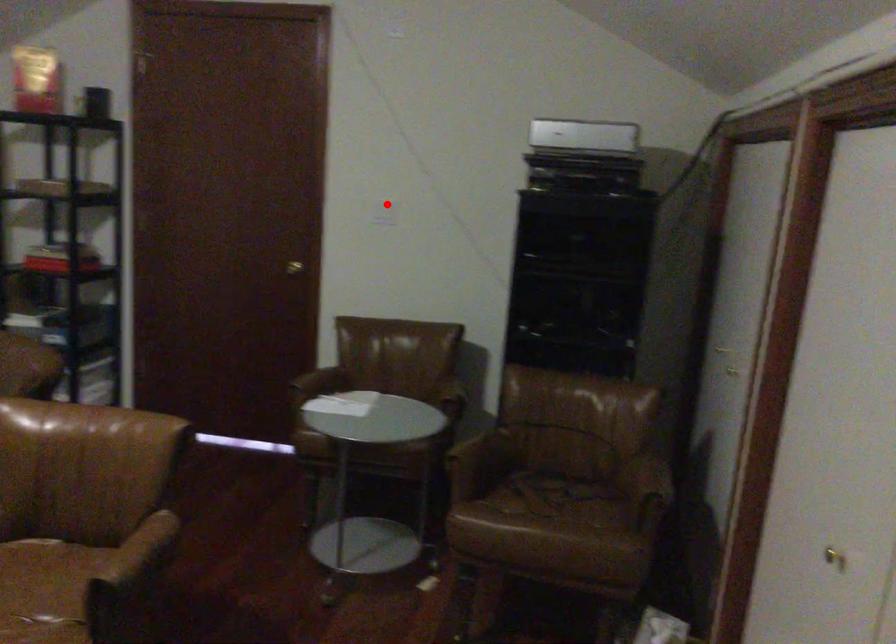
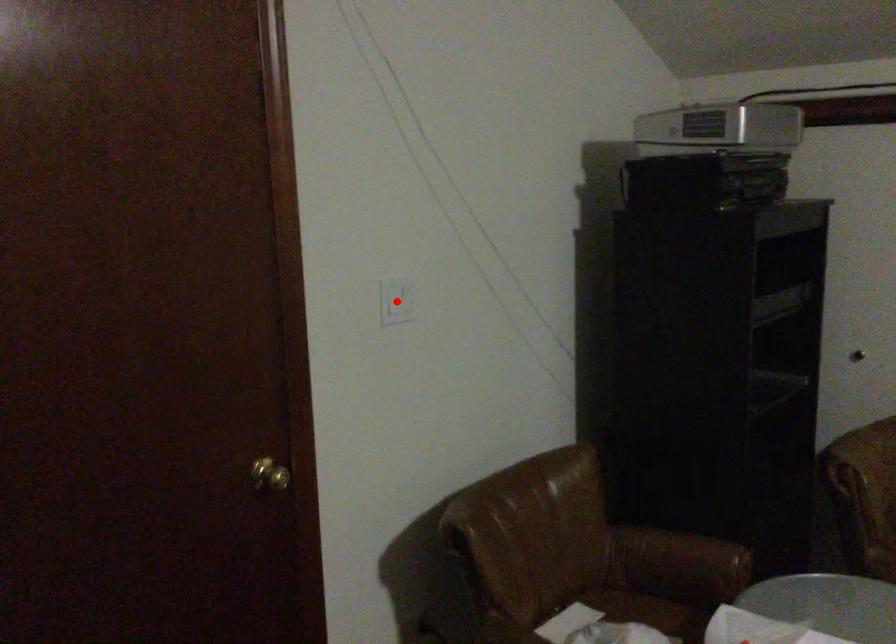
I am providing you with two images of the same scene from different viewpoints. A red point is marked on the first image and another point is marked on the second image. Does the point marked in image1 correspond to the same location as the one in image2?

Yes